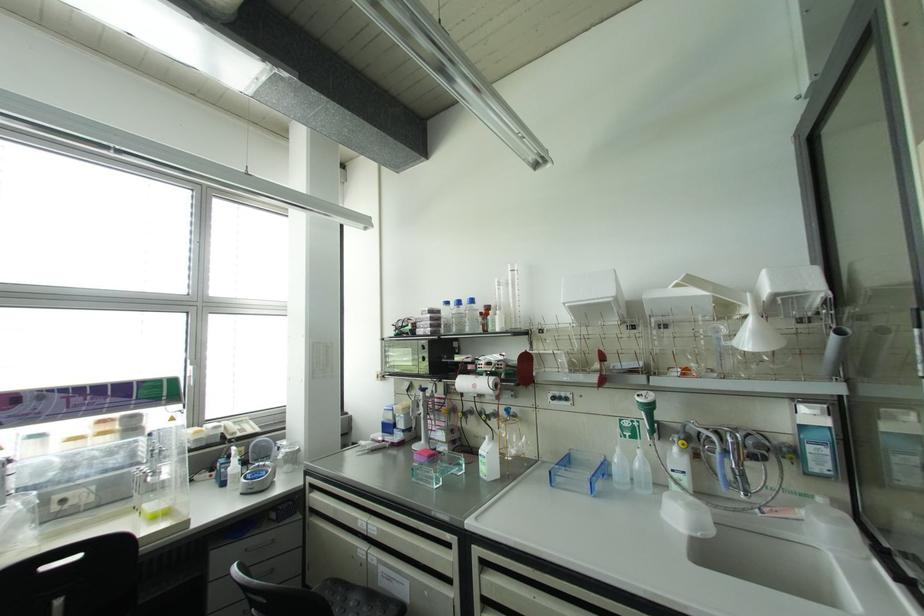
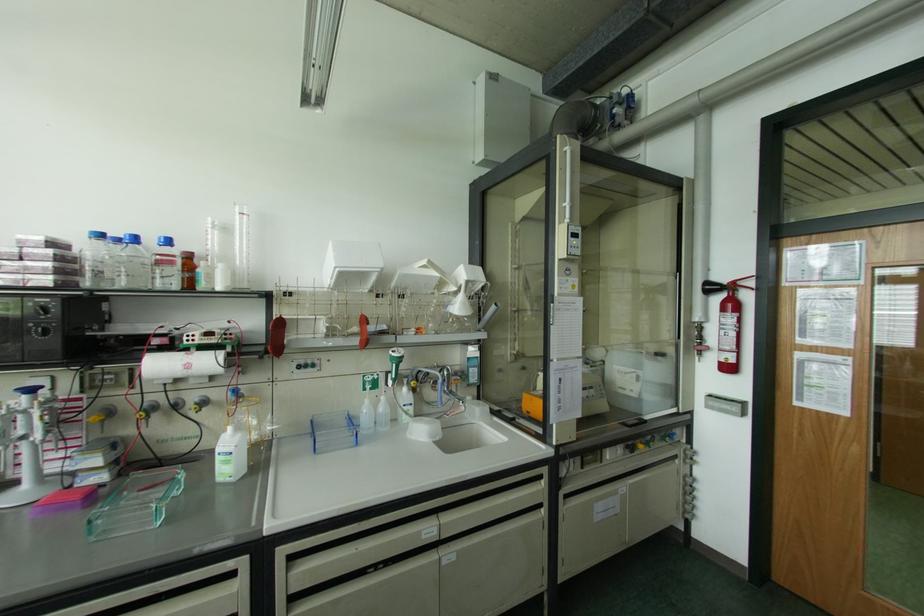
Locate, in the second image, the point that corresponds to pixel 724 451 in the first image.

(444, 379)